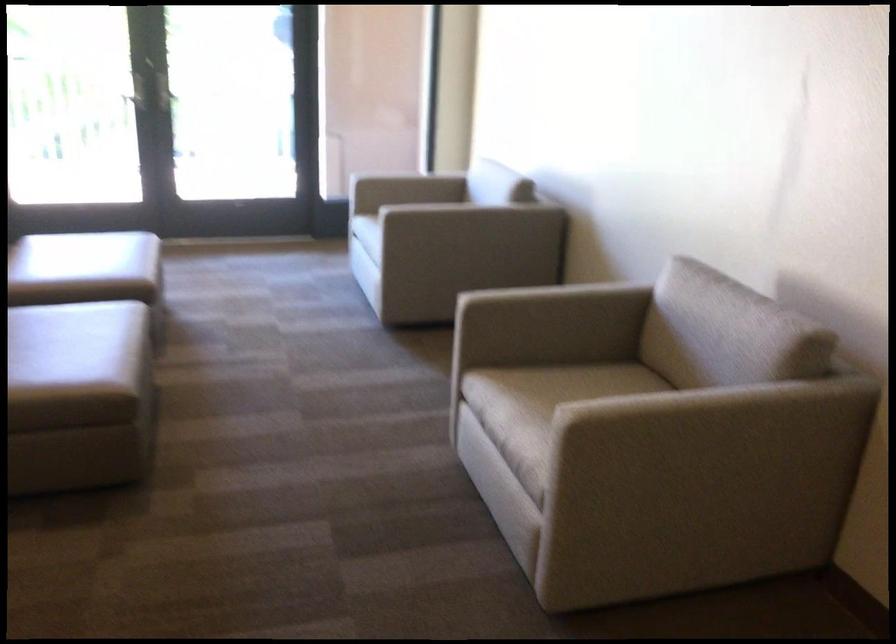
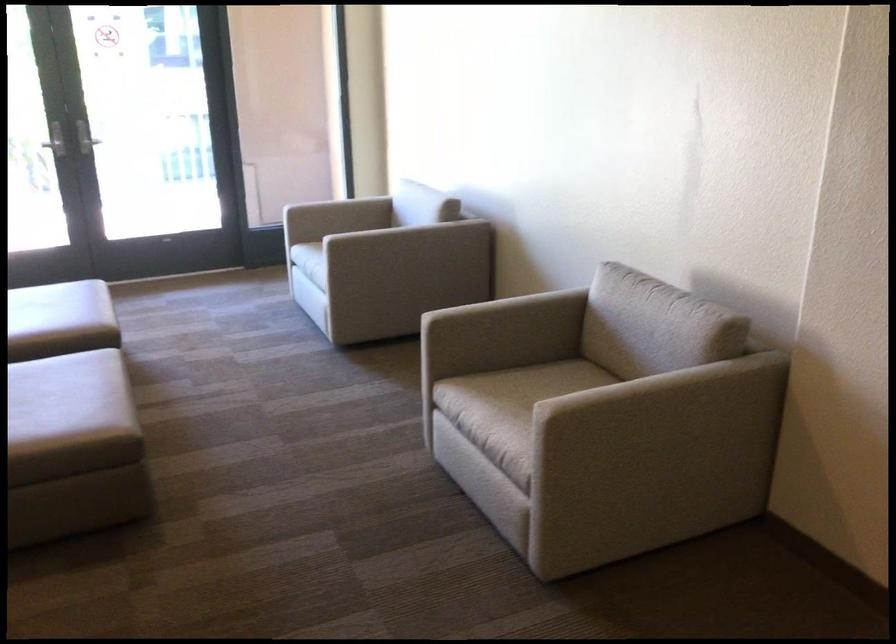
Find the pixel in the second image that matches [739,420] in the first image.

(681, 399)